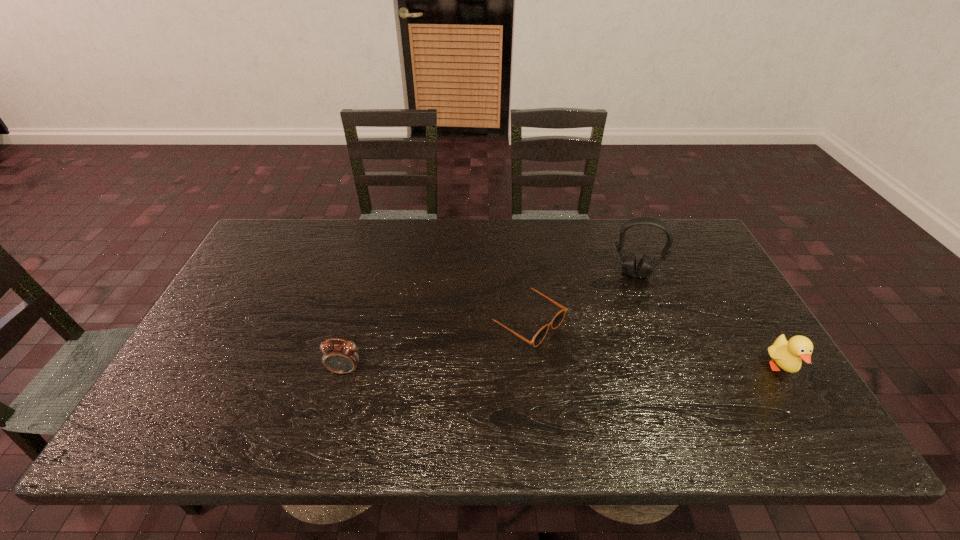
Identify the location of alarm clock. The image size is (960, 540). (338, 357).

At what (x,y) coordinates should I click in order to perform the action: click on duckling. Please return your answer as a coordinate pair (x, y). Image resolution: width=960 pixels, height=540 pixels. Looking at the image, I should click on (787, 354).

What are the coordinates of `the shortest object` in the screenshot? It's located at (557, 320).

Where is `the second object from left to right`? The image size is (960, 540). the second object from left to right is located at coordinates (557, 320).

Locate an element on the screen. the second object from right to left is located at coordinates (645, 267).

Identify the location of headset. (645, 267).

I want to click on vacant area located 0.240m on the front-facing side of the second object from left to right, so click(x=644, y=397).

This screenshot has width=960, height=540. Find the location of `vacant space located 0.060m on the front-facing side of the second object from left to right`. vacant space located 0.060m on the front-facing side of the second object from left to right is located at coordinates (578, 355).

Where is `vacant space located 0.130m on the front-facing side of the second object from left to right`? vacant space located 0.130m on the front-facing side of the second object from left to right is located at coordinates (603, 370).

Identify the location of vacant space located on the front-facing side of the headset. The height and width of the screenshot is (540, 960). (629, 293).